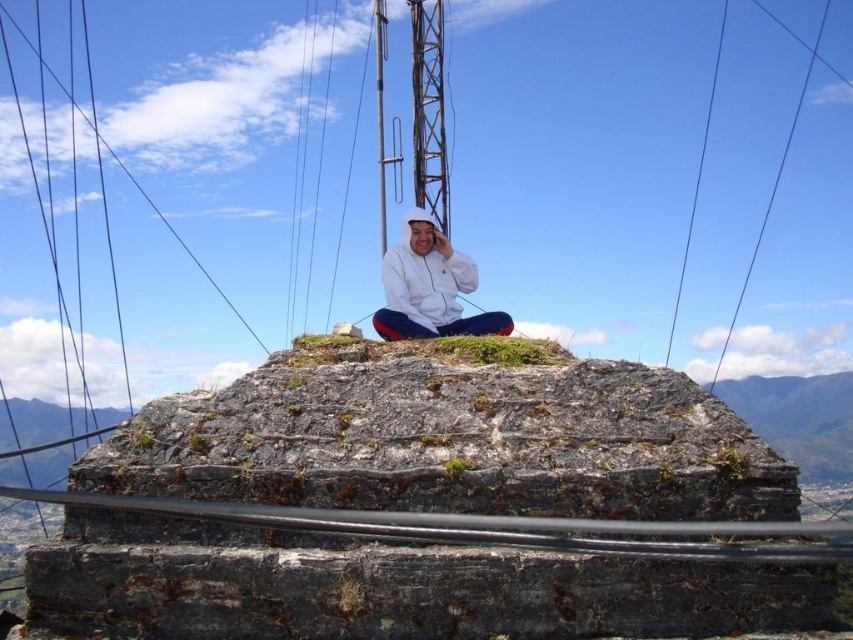
Which is in front, point (433, 282) or point (691, 218)?

Point (433, 282)

Does white matte jacket at center have a greater height compared to black wire at upper right?

In fact, white matte jacket at center may be shorter than black wire at upper right.

Which is in front, point (422, 275) or point (675, 316)?

Point (422, 275) is more forward.

This screenshot has height=640, width=853. What are the coordinates of `white matte jacket at center` in the screenshot? It's located at (428, 288).